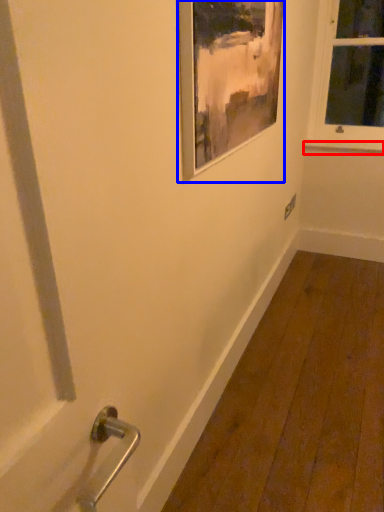
Question: Among these objects, which one is nearest to the camera, window sill (highlighted by a red box) or picture frame (highlighted by a blue box)?

Choices:
 (A) window sill
 (B) picture frame

Answer: (B)